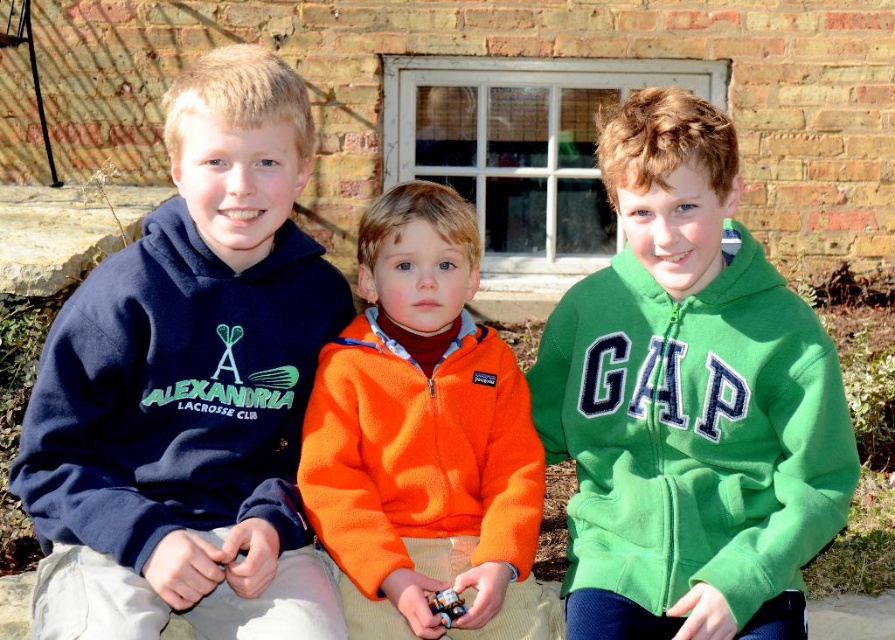
You are a photographer trying to capture a group shot of the two boys wearing fleece jackets. The navy fleece hoodie at left and the orange fleece jacket at center. You want to ensure both are clearly visible in the frame. Given their sizes, which one should you focus on first to ensure proper framing?

The navy fleece hoodie at left is larger in size than the orange fleece jacket at center, so you should focus on the navy fleece hoodie at left first to ensure it fits well within the frame before adjusting for the smaller orange fleece jacket at center.

You are standing in front of a brick building with a window where three boys are sitting. You want to place a small bench exactly at point (x=618, y=394). If the bench is 2 feet long, will it fit without overlapping the boys?

The distance between the viewer and point (x=618, y=394) is 10.70 feet. Since the bench is only 2 feet long, there is sufficient space for it to be placed at that point without overlapping the boys.